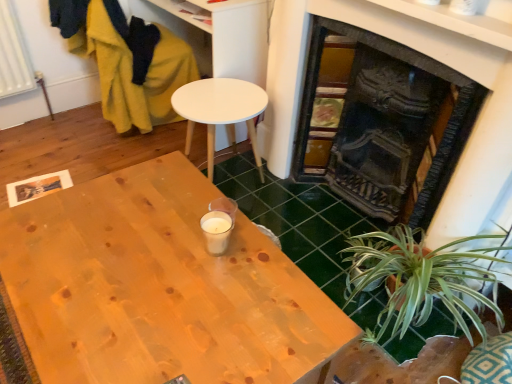
What is the approximate height of black cast iron fireplace at right?

The height of black cast iron fireplace at right is 37.79 inches.

What is the approximate width of black cast iron fireplace at right?

The width of black cast iron fireplace at right is 13.64 inches.

This screenshot has height=384, width=512. Describe the element at coordinates (159, 287) in the screenshot. I see `natural wood desk at center` at that location.

In order to face velvet mustard yellow swivel chair at left, should I rotate leftwards or rightwards?

Turn left by 15.287 degrees to look at velvet mustard yellow swivel chair at left.

Image resolution: width=512 pixels, height=384 pixels. In order to click on green leafy plant at lower right in this screenshot , I will do `click(419, 279)`.

This screenshot has width=512, height=384. Identify the location of black cast iron fireplace at right. (389, 122).

Which is less distant, (417, 302) or (262, 314)?

Point (417, 302) is farther from the camera than point (262, 314).

How different are the orientations of green leafy plant at lower right and natural wood desk at center in degrees?

There is a 87.3-degree angle between the facing directions of green leafy plant at lower right and natural wood desk at center.

In the image, there is a green leafy plant at lower right. Where is `desk below it (from the image's perspective)`? Image resolution: width=512 pixels, height=384 pixels. desk below it (from the image's perspective) is located at coordinates (159, 287).

Considering the relative sizes of green leafy plant at lower right and natural wood desk at center in the image provided, is green leafy plant at lower right bigger than natural wood desk at center?

No.

Can you confirm if velvet mustard yellow swivel chair at left is positioned to the right of black cast iron fireplace at right?

Incorrect, velvet mustard yellow swivel chair at left is not on the right side of black cast iron fireplace at right.

In terms of size, does velvet mustard yellow swivel chair at left appear bigger or smaller than black cast iron fireplace at right?

velvet mustard yellow swivel chair at left is smaller than black cast iron fireplace at right.

From the image's perspective, is velvet mustard yellow swivel chair at left under black cast iron fireplace at right?

No.

Considering the points (153, 56) and (339, 175), which point is in front, point (153, 56) or point (339, 175)?

The point (339, 175) is in front.

Is black cast iron fireplace at right inside green leafy plant at lower right?

Definitely not — black cast iron fireplace at right is not inside green leafy plant at lower right.

Is point (387, 304) farther from viewer compared to point (480, 86)?

That is True.

From their relative heights in the image, would you say green leafy plant at lower right is taller or shorter than black cast iron fireplace at right?

Considering their sizes, green leafy plant at lower right has less height than black cast iron fireplace at right.

Considering the relative sizes of green leafy plant at lower right and black cast iron fireplace at right in the image provided, is green leafy plant at lower right wider than black cast iron fireplace at right?

Indeed, green leafy plant at lower right has a greater width compared to black cast iron fireplace at right.

Which is more to the left, white matte table at center or black cast iron fireplace at right?

From the viewer's perspective, white matte table at center appears more on the left side.

Is white matte table at center outside of black cast iron fireplace at right?

That's correct, white matte table at center is outside of black cast iron fireplace at right.

Is white matte table at center smaller than black cast iron fireplace at right?

Correct, white matte table at center occupies less space than black cast iron fireplace at right.

Which is in front, white matte table at center or black cast iron fireplace at right?

Positioned in front is black cast iron fireplace at right.

Between velvet mustard yellow swivel chair at left and green leafy plant at lower right, which one has larger size?

velvet mustard yellow swivel chair at left is bigger.

Which is less distant, (145, 74) or (383, 246)?

The point (383, 246) is closer to the camera.

Considering the sizes of objects velvet mustard yellow swivel chair at left and green leafy plant at lower right in the image provided, who is taller, velvet mustard yellow swivel chair at left or green leafy plant at lower right?

With more height is velvet mustard yellow swivel chair at left.

Which of these two, velvet mustard yellow swivel chair at left or green leafy plant at lower right, is thinner?

With smaller width is green leafy plant at lower right.

Are black cast iron fireplace at right and natural wood desk at center making contact?

They are not placed beside each other.

Between black cast iron fireplace at right and natural wood desk at center, which one has less height?

Standing shorter between the two is natural wood desk at center.

How distant is black cast iron fireplace at right from natural wood desk at center?

The distance of black cast iron fireplace at right from natural wood desk at center is 37.06 inches.

What's the angular difference between natural wood desk at center and black cast iron fireplace at right's facing directions?

The angular difference between natural wood desk at center and black cast iron fireplace at right is 88.4 degrees.

From the image's perspective, would you say natural wood desk at center is positioned over black cast iron fireplace at right?

Actually, natural wood desk at center appears below black cast iron fireplace at right in the image.

Looking at this image, which point is more forward, (124, 244) or (402, 203)?

Positioned in front is point (124, 244).

How much distance is there between natural wood desk at center and black cast iron fireplace at right?

natural wood desk at center is 37.06 inches from black cast iron fireplace at right.

The image size is (512, 384). In order to click on houseplant on the right of natural wood desk at center in this screenshot , I will do (419, 279).

The image size is (512, 384). I want to click on swivel chair located behind the black cast iron fireplace at right, so pyautogui.click(x=127, y=61).

Looking at the image, which one is located further to black cast iron fireplace at right, velvet mustard yellow swivel chair at left or white matte table at center?

velvet mustard yellow swivel chair at left is further to black cast iron fireplace at right.

Which object lies further to the anchor point black cast iron fireplace at right, velvet mustard yellow swivel chair at left or green leafy plant at lower right?

velvet mustard yellow swivel chair at left lies further to black cast iron fireplace at right than the other object.

Estimate the real-world distances between objects in this image. Which object is closer to natural wood desk at center, green leafy plant at lower right or black cast iron fireplace at right?

Based on the image, green leafy plant at lower right appears to be nearer to natural wood desk at center.

Estimate the real-world distances between objects in this image. Which object is closer to velvet mustard yellow swivel chair at left, black cast iron fireplace at right or white matte table at center?

Based on the image, white matte table at center appears to be nearer to velvet mustard yellow swivel chair at left.

Considering their positions, is natural wood desk at center positioned further to black cast iron fireplace at right than white matte table at center?

The object further to black cast iron fireplace at right is natural wood desk at center.

Considering their positions, is natural wood desk at center positioned closer to black cast iron fireplace at right than green leafy plant at lower right?

green leafy plant at lower right is closer to black cast iron fireplace at right.

Which object lies further to the anchor point black cast iron fireplace at right, natural wood desk at center or velvet mustard yellow swivel chair at left?

velvet mustard yellow swivel chair at left.

Based on their spatial positions, is natural wood desk at center or white matte table at center further from velvet mustard yellow swivel chair at left?

Based on the image, natural wood desk at center appears to be further to velvet mustard yellow swivel chair at left.

Locate an element on the screen. The height and width of the screenshot is (384, 512). houseplant between natural wood desk at center and white matte table at center along the z-axis is located at coordinates (419, 279).

Locate an element on the screen. Image resolution: width=512 pixels, height=384 pixels. fireplace between white matte table at center and green leafy plant at lower right is located at coordinates (389, 122).

Locate an element on the screen. The image size is (512, 384). fireplace between natural wood desk at center and green leafy plant at lower right in the horizontal direction is located at coordinates (389, 122).

Identify the location of fireplace located between natural wood desk at center and white matte table at center in the depth direction. (389, 122).